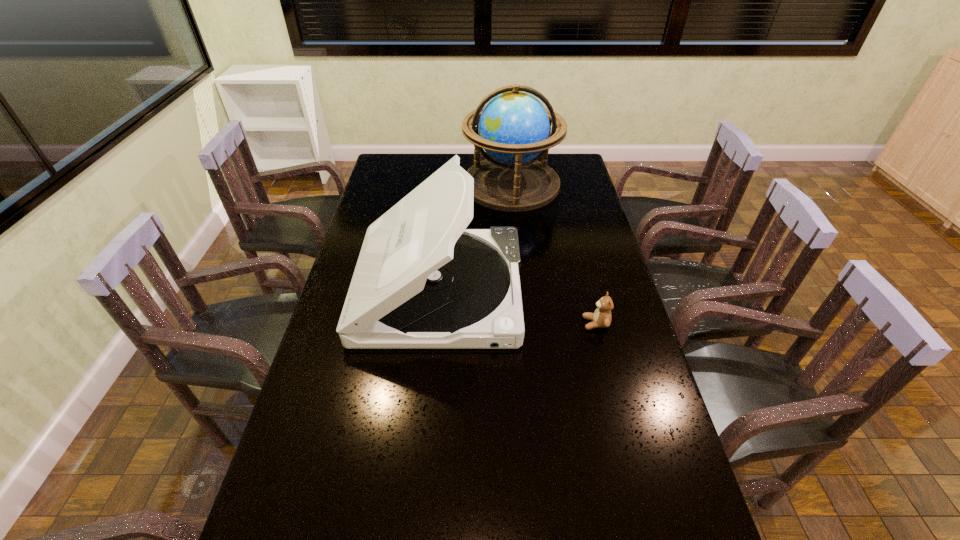
Identify the location of globe. This screenshot has height=540, width=960. (514, 128).

This screenshot has height=540, width=960. In order to click on CD player in this screenshot , I will do `click(422, 280)`.

Locate an element on the screen. This screenshot has height=540, width=960. the shortest object is located at coordinates (601, 317).

The height and width of the screenshot is (540, 960). I want to click on free space located 0.070m on the right of the farthest object, so click(575, 185).

At what (x,y) coordinates should I click in order to perform the action: click on vacant space located 0.050m on the control panel of the CD player. Please return your answer as a coordinate pair (x, y). Looking at the image, I should click on (537, 291).

This screenshot has width=960, height=540. In order to click on vacant region located 0.230m on the front-facing side of the teddy bear in this screenshot , I will do `click(507, 323)`.

This screenshot has height=540, width=960. What are the coordinates of `free space located on the front-facing side of the teddy bear` in the screenshot? It's located at (564, 323).

Find the location of a particular element. This screenshot has width=960, height=540. free space located 0.050m on the front-facing side of the teddy bear is located at coordinates (566, 323).

Where is `object present at the far edge`? object present at the far edge is located at coordinates pos(514,128).

The height and width of the screenshot is (540, 960). I want to click on object at the left edge, so click(x=422, y=280).